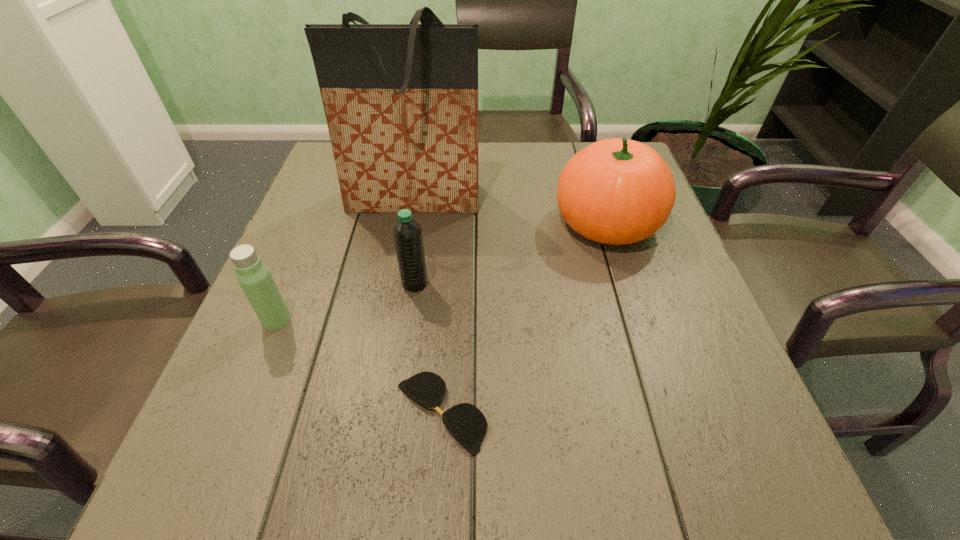
You are a GUI agent. You are given a task and a screenshot of the screen. Output one action in this format:
    pyautogui.click(x=<x>, y=<y>)
    Task: Click on the vacant space located on the right of the water bottle
    The width and height of the screenshot is (960, 540).
    Given the screenshot: What is the action you would take?
    pyautogui.click(x=525, y=284)

I want to click on vacant space located on the right of the thermos bottle, so click(328, 320).

Where is `free space located on the back of the nearest object`? free space located on the back of the nearest object is located at coordinates (447, 313).

This screenshot has width=960, height=540. Find the location of `shopping bag situated at the far edge`. shopping bag situated at the far edge is located at coordinates (401, 100).

Locate an element on the screen. The height and width of the screenshot is (540, 960). pumpkin that is at the far edge is located at coordinates (616, 191).

Where is `object present at the near edge`? object present at the near edge is located at coordinates (467, 424).

Where is `shopping bag that is at the left edge`? shopping bag that is at the left edge is located at coordinates (401, 100).

Identify the location of thermos bottle that is at the left edge. 254,277.

Identify the location of object that is positioned at the right edge. (616, 191).

This screenshot has height=540, width=960. What are the coordinates of `object positioned at the far left corner` in the screenshot? It's located at (401, 100).